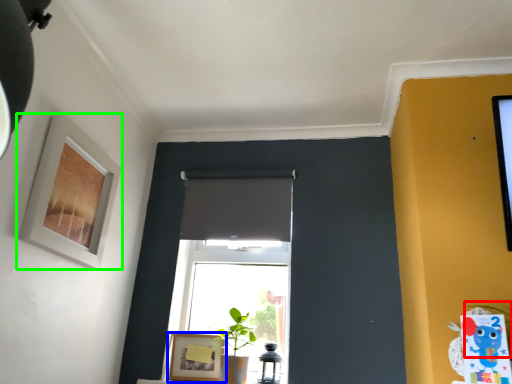
Question: Which is nearer to the plant (highlighted by a red box)? picture frame (highlighted by a blue box) or picture frame (highlighted by a green box).

Choices:
 (A) picture frame
 (B) picture frame

Answer: (A)